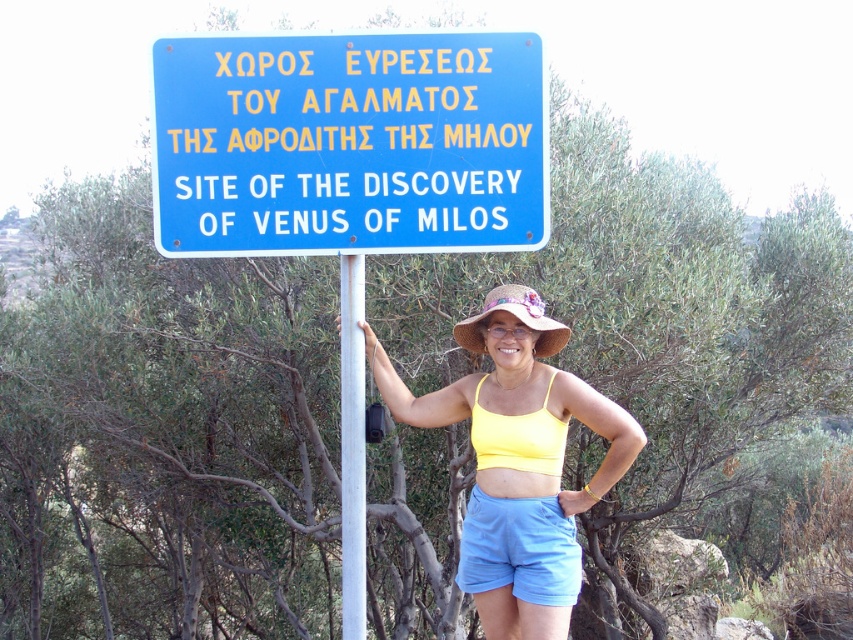
Question: Which is nearer to the white metallic pole at center?

Choices:
 (A) light blue fabric shorts at center
 (B) blue metallic sign at center

Answer: (B)

Question: Which point is farther to the camera?

Choices:
 (A) light blue fabric shorts at center
 (B) yellow fabric top at center
 (C) blue metallic sign at center
 (D) white metallic pole at center

Answer: (A)

Question: Is blue metallic sign at center further to the viewer compared to yellow fabric top at center?

Choices:
 (A) no
 (B) yes

Answer: (A)

Question: Does blue metallic sign at center appear over white metallic pole at center?

Choices:
 (A) yes
 (B) no

Answer: (A)

Question: Which object appears closest to the camera in this image?

Choices:
 (A) blue metallic sign at center
 (B) white metallic pole at center
 (C) yellow fabric top at center

Answer: (A)

Question: Is blue metallic sign at center to the left of light blue fabric shorts at center from the viewer's perspective?

Choices:
 (A) no
 (B) yes

Answer: (B)